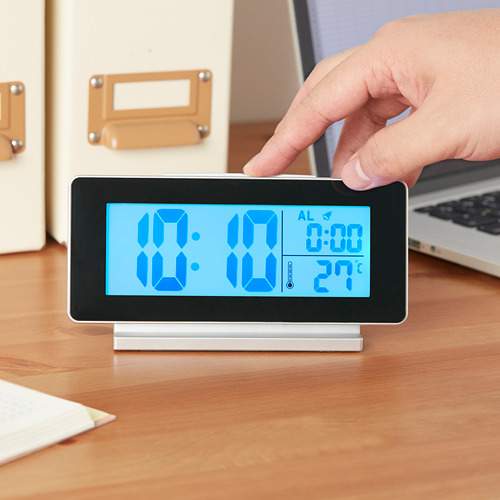
The width and height of the screenshot is (500, 500). I want to click on clock, so coord(236,265).